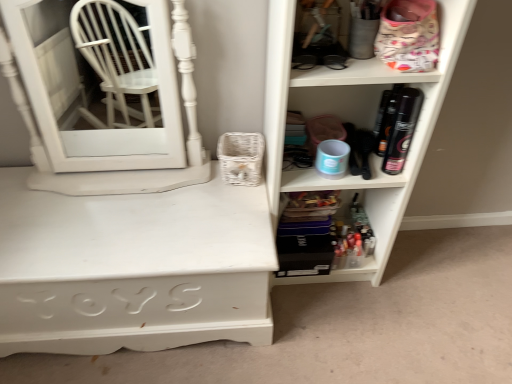
Question: Looking at the image, does translucent plastic containers at lower center, which is counted as the second shelf, starting from the top, seem bigger or smaller compared to matte white shelf at right, placed as the 1th shelf when sorted from top to bottom?

Choices:
 (A) small
 (B) big

Answer: (A)

Question: In the image, is translucent plastic containers at lower center, which is counted as the second shelf, starting from the top, positioned in front of or behind matte white shelf at right, which ranks as the 2th shelf in bottom-to-top order?

Choices:
 (A) behind
 (B) front

Answer: (A)

Question: Estimate the real-world distances between objects in this image. Which object is farther from the white painted wood desk at lower left?

Choices:
 (A) white glossy medicine cabinet at left
 (B) matte white shelf at right, placed as the 1th shelf when sorted from top to bottom
 (C) translucent plastic containers at lower center, which is counted as the second shelf, starting from the top

Answer: (C)

Question: Considering the real-world distances, which object is farthest from the translucent plastic containers at lower center, which is counted as the second shelf, starting from the top?

Choices:
 (A) matte white shelf at right, placed as the 1th shelf when sorted from top to bottom
 (B) white painted wood desk at lower left
 (C) white glossy medicine cabinet at left

Answer: (C)